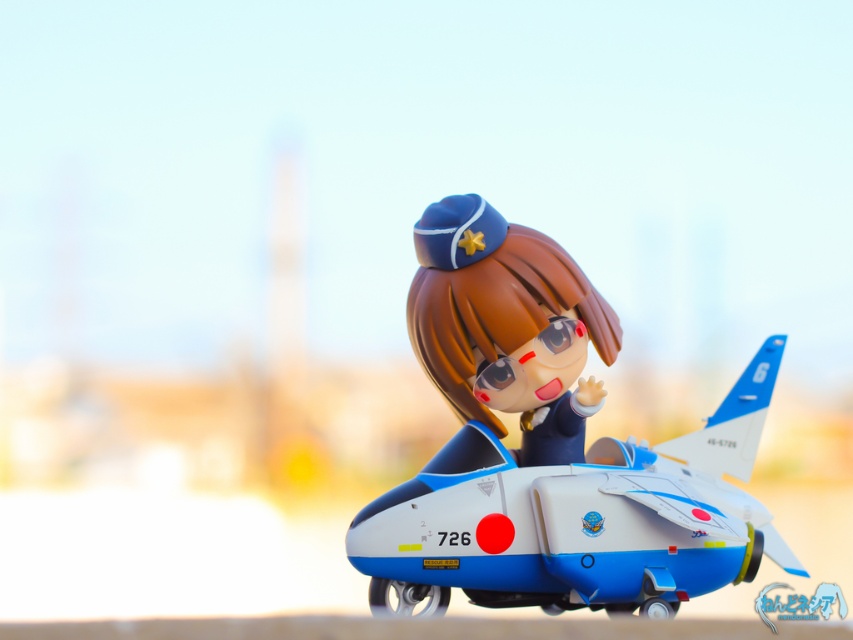
You are a collector who wants to display both the blue plastic airplane at center and the satin blue uniform at center on a shelf. Based on their positions in the image, which object should you place higher on the shelf to maintain the same visual relationship as shown?

The satin blue uniform at center should be placed higher on the shelf since the blue plastic airplane at center is located below it in the image.

You are a collector who wants to display the blue plastic airplane at center and the satin blue uniform at center on a shelf. The shelf has a width of 1 meter. Can both items fit side by side without overlapping?

The blue plastic airplane at center might be wider than the satin blue uniform at center. Since the shelf is 1 meter wide, it depends on their combined widths. If the airplane is wider, the total width could exceed 1 meter, so they might not fit. Check their actual dimensions.